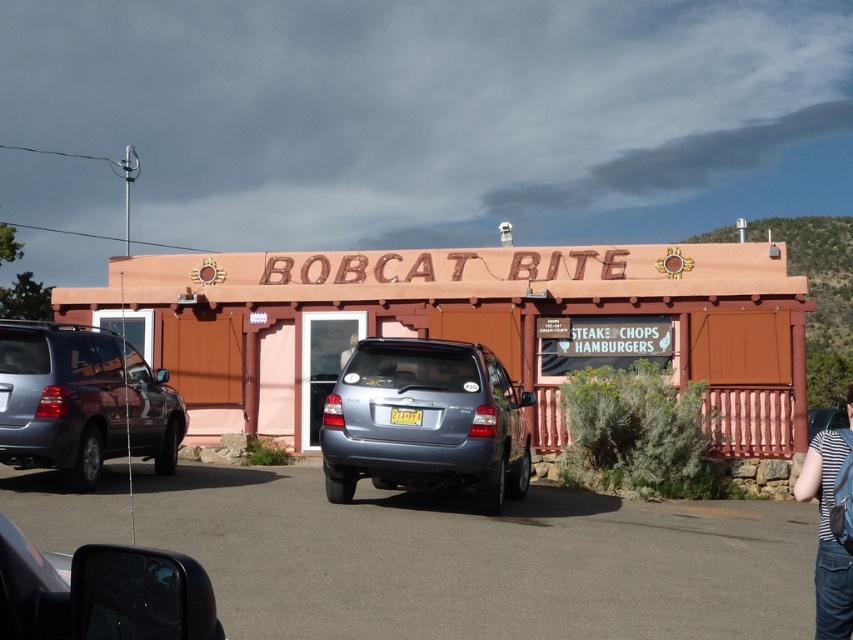
Question: Which of these objects is positioned closest to the matte gray suv at left?

Choices:
 (A) striped fabric shirt at lower right
 (B) shiny silver mirror at lower left

Answer: (A)

Question: Does satin blue suv at center lie in front of matte gray suv at left?

Choices:
 (A) yes
 (B) no

Answer: (B)

Question: Where is gray asphalt parking lot at center located in relation to satin blue suv at center in the image?

Choices:
 (A) below
 (B) above

Answer: (A)

Question: Which of the following is the farthest from the observer?

Choices:
 (A) metallic silver suv at center
 (B) gray asphalt parking lot at center
 (C) shiny silver mirror at lower left

Answer: (A)

Question: Can you confirm if shiny silver mirror at lower left is positioned above metallic silver suv at center?

Choices:
 (A) no
 (B) yes

Answer: (B)

Question: Which object is the farthest from the satin blue suv at center?

Choices:
 (A) gray asphalt parking lot at center
 (B) shiny silver mirror at lower left
 (C) metallic silver suv at center

Answer: (B)